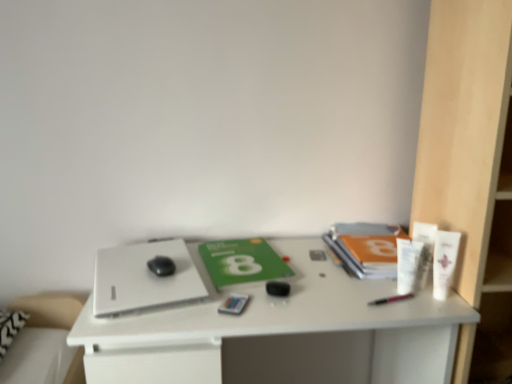
This screenshot has height=384, width=512. I want to click on free area in between orange matte book at right, the first paperback book when ordered from right to left, and matte plastic card at center, marked as the second stationery in a right-to-left arrangement, so click(310, 279).